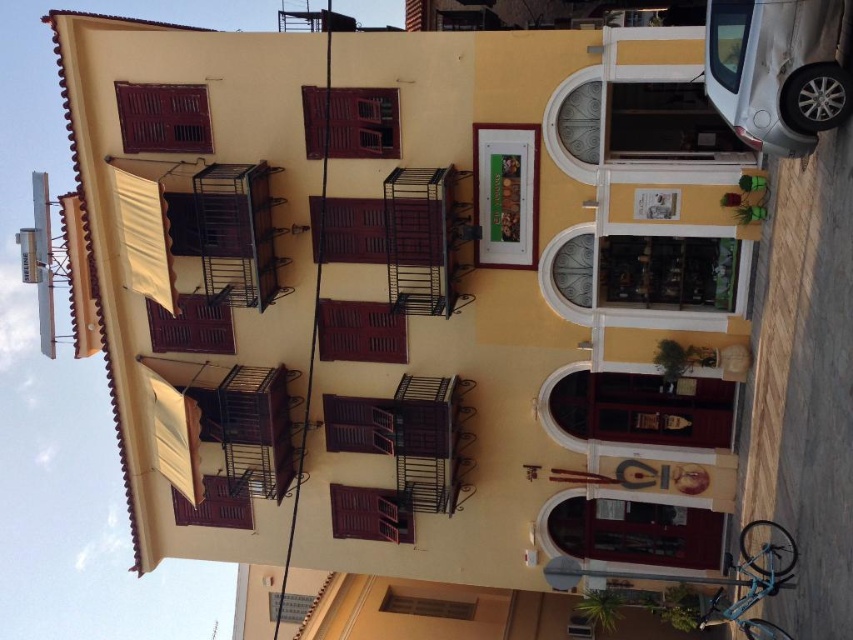
Question: Which object is closer to the camera taking this photo?

Choices:
 (A) silver metallic car at upper right
 (B) wooden at lower left
 (C) wooden at center

Answer: (A)

Question: Is brown wooden balcony at upper left thinner than wooden at lower center?

Choices:
 (A) no
 (B) yes

Answer: (A)

Question: Does silver metallic car at upper right have a larger size compared to brown wooden balcony at upper left?

Choices:
 (A) no
 (B) yes

Answer: (B)

Question: Is silver metallic car at upper right thinner than wooden at center?

Choices:
 (A) no
 (B) yes

Answer: (A)

Question: Which point is closer to the camera taking this photo?

Choices:
 (A) (216, 524)
 (B) (347, 513)
 (C) (755, 109)
 (D) (199, 141)

Answer: (C)

Question: Which point is farther to the camera?

Choices:
 (A) (341, 499)
 (B) (397, 99)

Answer: (A)